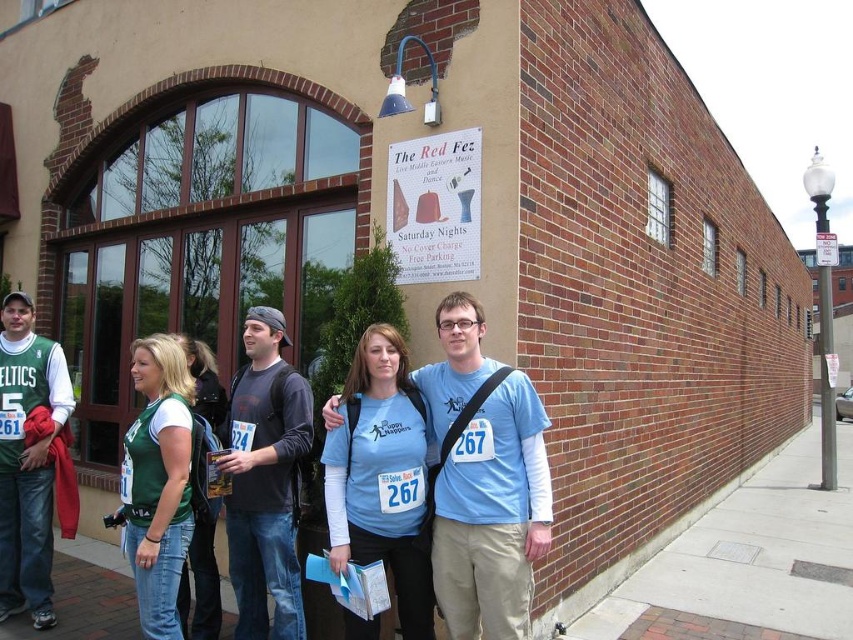
Who is lower down, brick pavement at lower right or green fabric shirt at center?

Positioned lower is brick pavement at lower right.

Does brick pavement at lower right have a greater height compared to green fabric shirt at center?

No, brick pavement at lower right is not taller than green fabric shirt at center.

Identify the location of brick pavement at lower right. This screenshot has height=640, width=853. (752, 556).

Between blue fabric shirt at center and green fabric shirt at center, which one has more height?

blue fabric shirt at center

Which is below, blue fabric shirt at center or green fabric shirt at center?

green fabric shirt at center is below.

The width and height of the screenshot is (853, 640). I want to click on blue fabric shirt at center, so click(x=381, y=476).

The width and height of the screenshot is (853, 640). I want to click on blue fabric shirt at center, so click(x=381, y=476).

Who is more distant from viewer, (x=679, y=572) or (x=419, y=467)?

The point (x=679, y=572) is more distant.

Between point (729, 541) and point (338, 536), which one is positioned behind?

The point (729, 541) is more distant.

You are a GUI agent. You are given a task and a screenshot of the screen. Output one action in this format:
    pyautogui.click(x=<x>, y=<y>)
    Task: Click on the brick pavement at lower right
    Image resolution: width=853 pixels, height=640 pixels.
    Given the screenshot: What is the action you would take?
    pyautogui.click(x=752, y=556)